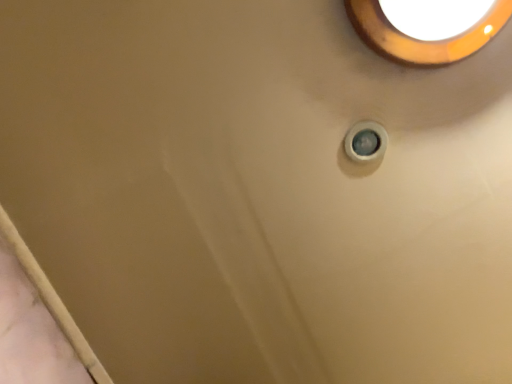
Measure the distance between point (x=352, y=145) and camera.

31.10 inches.

The height and width of the screenshot is (384, 512). What do you see at coordinates (365, 142) in the screenshot?
I see `white plastic knob at upper right` at bounding box center [365, 142].

Measure the distance between white plastic knob at upper right and camera.

white plastic knob at upper right and camera are 30.43 inches apart.

At what (x,y) coordinates should I click in order to perform the action: click on white plastic knob at upper right. Please return your answer as a coordinate pair (x, y). Looking at the image, I should click on (365, 142).

The width and height of the screenshot is (512, 384). Describe the element at coordinates (421, 40) in the screenshot. I see `matte orange light fixture at upper right` at that location.

At what (x,y) coordinates should I click in order to perform the action: click on matte orange light fixture at upper right. Please return your answer as a coordinate pair (x, y). The height and width of the screenshot is (384, 512). Looking at the image, I should click on 421,40.

The width and height of the screenshot is (512, 384). Find the location of `white plastic knob at upper right`. white plastic knob at upper right is located at coordinates (365, 142).

From the picture: Between white plastic knob at upper right and matte orange light fixture at upper right, which one appears on the left side from the viewer's perspective?

From the viewer's perspective, white plastic knob at upper right appears more on the left side.

Which object is closer to the camera, white plastic knob at upper right or matte orange light fixture at upper right?

matte orange light fixture at upper right is closer to the camera.

Considering the positions of point (357, 139) and point (391, 28), is point (357, 139) closer or farther from the camera than point (391, 28)?

Point (357, 139) is positioned farther from the camera compared to point (391, 28).

From the image's perspective, which one is positioned lower, white plastic knob at upper right or matte orange light fixture at upper right?

white plastic knob at upper right appears lower in the image.

From a real-world perspective, does white plastic knob at upper right sit lower than matte orange light fixture at upper right?

No, from a real-world perspective, white plastic knob at upper right is not under matte orange light fixture at upper right.

In terms of width, does white plastic knob at upper right look wider or thinner when compared to matte orange light fixture at upper right?

In the image, white plastic knob at upper right appears to be more narrow than matte orange light fixture at upper right.

Between white plastic knob at upper right and matte orange light fixture at upper right, which one has more height?

With more height is matte orange light fixture at upper right.

Between white plastic knob at upper right and matte orange light fixture at upper right, which one has larger size?

With larger size is matte orange light fixture at upper right.

Does white plastic knob at upper right contain matte orange light fixture at upper right?

No, white plastic knob at upper right does not contain matte orange light fixture at upper right.

Is white plastic knob at upper right positioned far away from matte orange light fixture at upper right?

That's not correct — white plastic knob at upper right is a little close to matte orange light fixture at upper right.

Could you tell me if white plastic knob at upper right is turned towards matte orange light fixture at upper right?

No, white plastic knob at upper right is not aimed at matte orange light fixture at upper right.

How many degrees apart are the facing directions of white plastic knob at upper right and matte orange light fixture at upper right?

There is a 88.4-degree angle between the facing directions of white plastic knob at upper right and matte orange light fixture at upper right.

You are a GUI agent. You are given a task and a screenshot of the screen. Output one action in this format:
    pyautogui.click(x=<x>, y=<y>)
    Task: Click on the lighting below the white plastic knob at upper right (from a real-world perspective)
    
    Given the screenshot: What is the action you would take?
    pyautogui.click(x=421, y=40)

Considering the positions of objects matte orange light fixture at upper right and white plastic knob at upper right in the image provided, who is more to the left, matte orange light fixture at upper right or white plastic knob at upper right?

A: white plastic knob at upper right.

From the picture: Is the depth of matte orange light fixture at upper right greater than that of white plastic knob at upper right?

No, the depth of matte orange light fixture at upper right is less than that of white plastic knob at upper right.

Which point is more distant from viewer, [423,63] or [371,122]?

The point [371,122] is farther from the camera.

From the image's perspective, between matte orange light fixture at upper right and white plastic knob at upper right, which one is located above?

From the image's view, matte orange light fixture at upper right is above.

From a real-world perspective, is matte orange light fixture at upper right beneath white plastic knob at upper right?

Correct, in the physical world, matte orange light fixture at upper right is lower than white plastic knob at upper right.

Is matte orange light fixture at upper right thinner than white plastic knob at upper right?

In fact, matte orange light fixture at upper right might be wider than white plastic knob at upper right.

From their relative heights in the image, would you say matte orange light fixture at upper right is taller or shorter than white plastic knob at upper right?

matte orange light fixture at upper right is taller than white plastic knob at upper right.

Based on their sizes in the image, would you say matte orange light fixture at upper right is bigger or smaller than white plastic knob at upper right?

Considering their sizes, matte orange light fixture at upper right takes up more space than white plastic knob at upper right.

Would you say matte orange light fixture at upper right is outside white plastic knob at upper right?

Indeed, matte orange light fixture at upper right is completely outside white plastic knob at upper right.

Is matte orange light fixture at upper right not near white plastic knob at upper right?

No, matte orange light fixture at upper right is in close proximity to white plastic knob at upper right.

Could you tell me if matte orange light fixture at upper right is facing white plastic knob at upper right?

No, matte orange light fixture at upper right is not oriented towards white plastic knob at upper right.

Can you tell me how much matte orange light fixture at upper right and white plastic knob at upper right differ in facing direction?

The facing directions of matte orange light fixture at upper right and white plastic knob at upper right are 88.4 degrees apart.

In order to click on knob below the matte orange light fixture at upper right (from the image's perspective) in this screenshot , I will do `click(365, 142)`.

At what (x,y) coordinates should I click in order to perform the action: click on knob to the left of matte orange light fixture at upper right. Please return your answer as a coordinate pair (x, y). The width and height of the screenshot is (512, 384). Looking at the image, I should click on (365, 142).

Identify the location of knob below the matte orange light fixture at upper right (from the image's perspective). (365, 142).